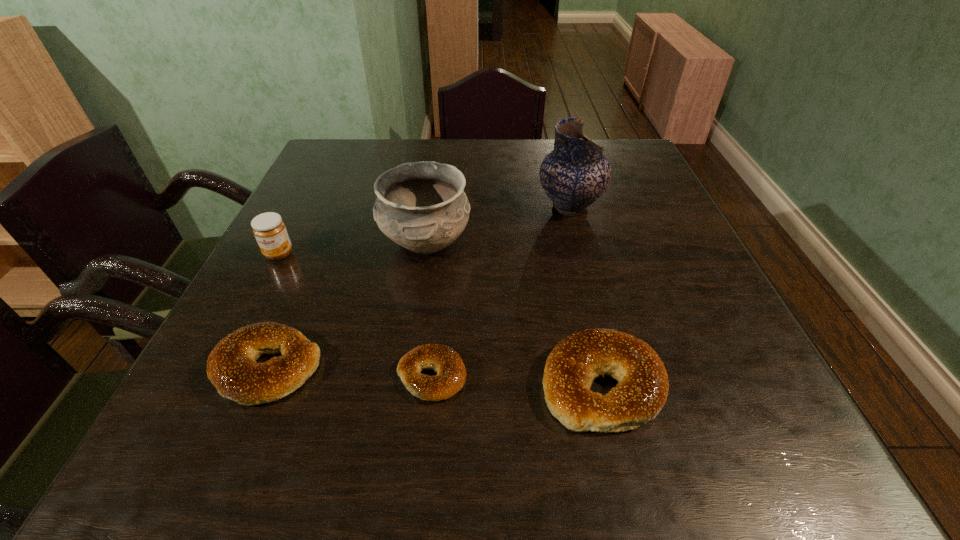
You are a GUI agent. You are given a task and a screenshot of the screen. Output one action in this format:
    pyautogui.click(x=<x>, y=<y>)
    Task: Click on the free space that satisfies the following two spatial constraints: 1. on the back side of the shortest bagel; 2. on the left side of the taller pottery
    The width and height of the screenshot is (960, 540).
    Given the screenshot: What is the action you would take?
    pyautogui.click(x=447, y=207)